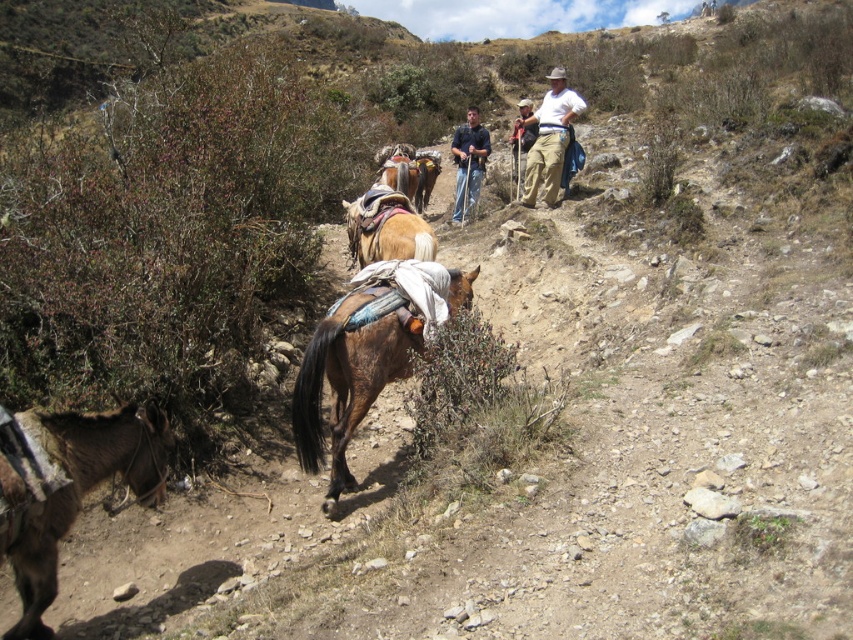
Question: Among these objects, which one is farthest from the camera?

Choices:
 (A) brown leather saddle at center
 (B) blue jeans at center
 (C) light brown leather pants at upper center

Answer: (B)

Question: Is brown leather donkey at lower left smaller than brown textured mule at center?

Choices:
 (A) no
 (B) yes

Answer: (A)

Question: Estimate the real-world distances between objects in this image. Which object is closer to the brown rough horse at center?

Choices:
 (A) brown textured mule at center
 (B) brown leather saddle at center
 (C) blue jeans at center
 (D) brown leather donkey at lower left

Answer: (D)

Question: Can you confirm if brown rough horse at center is wider than light brown leather pants at upper center?

Choices:
 (A) no
 (B) yes

Answer: (B)

Question: Which point appears farthest from the camera in this image?

Choices:
 (A) (454, 147)
 (B) (511, 156)

Answer: (B)

Question: Observing the image, what is the correct spatial positioning of brown leather donkey at lower left in reference to khaki cotton pants at center?

Choices:
 (A) below
 (B) above

Answer: (A)